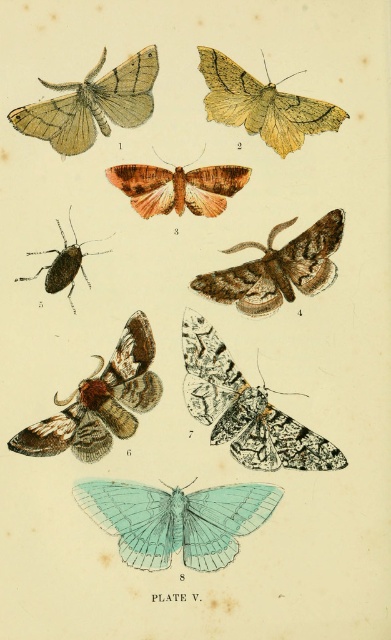
Can you confirm if black and white speckled moth at center is smaller than brown textured moth at center?

Incorrect, black and white speckled moth at center is not smaller in size than brown textured moth at center.

Does black and white speckled moth at center appear on the right side of brown textured moth at center?

Indeed, black and white speckled moth at center is positioned on the right side of brown textured moth at center.

This screenshot has height=640, width=391. I want to click on black and white speckled moth at center, so coord(245,408).

Identify the location of black and white speckled moth at center. (245, 408).

Can you confirm if matte brown moth at upper left is bigger than brown textured moth at center?

Yes, matte brown moth at upper left is bigger than brown textured moth at center.

Can you confirm if matte brown moth at upper left is shorter than brown textured moth at center?

No, matte brown moth at upper left is not shorter than brown textured moth at center.

Is point (118, 124) closer to camera compared to point (200, 198)?

That is True.

This screenshot has width=391, height=640. Identify the location of matte brown moth at upper left. (91, 104).

Who is positioned more to the left, translucent teal moth at bottom or brown fuzzy moth at lower left?

brown fuzzy moth at lower left

Does translucent teal moth at bottom have a larger size compared to brown fuzzy moth at lower left?

Actually, translucent teal moth at bottom might be smaller than brown fuzzy moth at lower left.

Find the location of a particular element. translucent teal moth at bottom is located at coordinates (177, 518).

Where is `translucent teal moth at bottom`? The image size is (391, 640). translucent teal moth at bottom is located at coordinates (177, 518).